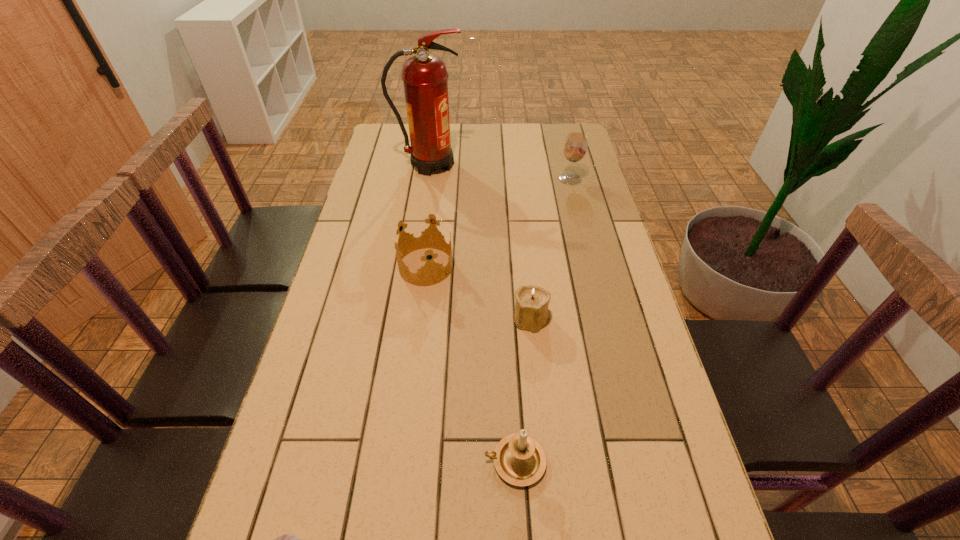
Identify the location of the tallest object. The width and height of the screenshot is (960, 540). (424, 75).

Find the location of a particular element. Image resolution: width=960 pixels, height=540 pixels. wineglass is located at coordinates (575, 146).

You are a GUI agent. You are given a task and a screenshot of the screen. Output one action in this format:
    pyautogui.click(x=<x>, y=<y>)
    Task: Click on the rightmost object
    Image resolution: width=960 pixels, height=540 pixels.
    Given the screenshot: What is the action you would take?
    pyautogui.click(x=575, y=146)

At what (x,y) coordinates should I click in order to perform the action: click on crown. Please return your answer as a coordinate pair (x, y). Looking at the image, I should click on (419, 231).

Where is `the nearer candle_holder`? The image size is (960, 540). the nearer candle_holder is located at coordinates (519, 459).

This screenshot has height=540, width=960. I want to click on the farther candle_holder, so click(531, 309).

Where is `vacant space located 0.110m on the front-facing side of the tallest object`? vacant space located 0.110m on the front-facing side of the tallest object is located at coordinates (494, 165).

You are a GUI agent. You are given a task and a screenshot of the screen. Output one action in this format:
    pyautogui.click(x=<x>, y=<y>)
    Task: Click on the free space located 0.360m on the front of the wineglass
    
    Given the screenshot: What is the action you would take?
    pyautogui.click(x=589, y=256)

The width and height of the screenshot is (960, 540). I want to click on blank space located on the right of the third farthest object, so (x=579, y=267).

The height and width of the screenshot is (540, 960). Identify the location of vacant point located with a handle on the side of the nearer candle_holder. (327, 461).